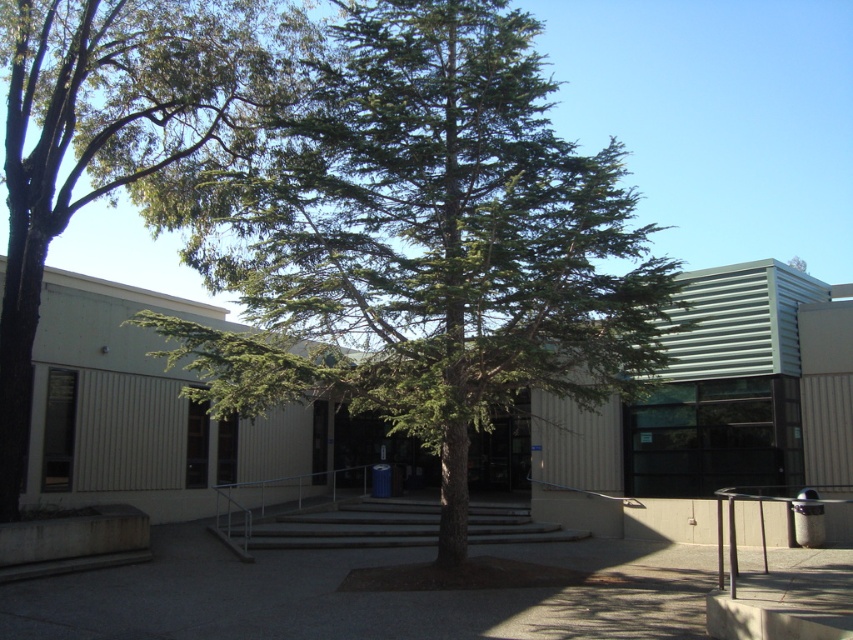
You are a visitor approaching the entrance of the building and want to know which object, the green leafy tree at center or the gray concrete stairs at center, is taller. Based on the scene, can you determine which one is taller?

The green leafy tree at center has a greater height compared to the gray concrete stairs at center, so the green leafy tree at center is taller.

You are a delivery person trying to park your 2.5 meter wide delivery van. You need to know if there is enough space between the green leafy tree at center and the gray concrete stairs at center to park. Can you fit the van there?

The green leafy tree at center is thinner than the gray concrete stairs at center, but the description does not provide specific measurements of the space between them. Therefore, it is unclear if the van will fit.

You are standing at the entrance of the building and want to take a photo of the green leafy tree at center. If your camera has a maximum focus range of 35 feet, will you be able to capture the tree clearly?

The green leafy tree at center and camera are 38.43 feet apart, which exceeds the camera maximum focus range of 35 feet. Therefore, the camera cannot capture the tree clearly.